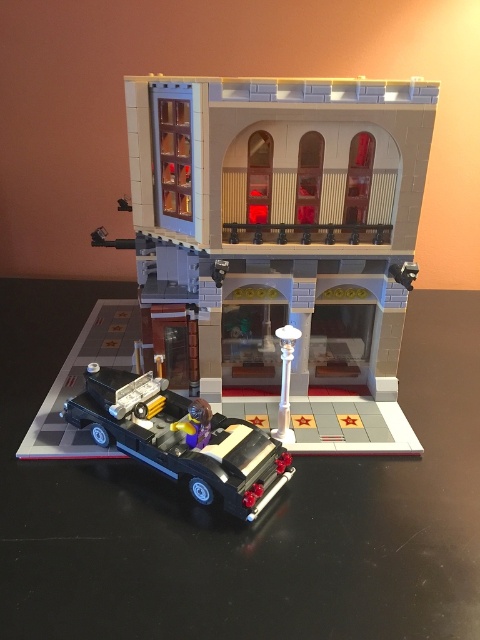
Based on the photo, you are a delivery person trying to reach the matte gray building at center. There is a black plastic car at lower left blocking your path. Can you go around the car to reach the building?

The black plastic car at lower left is behind matte gray building at center, so it is not blocking the path. You can reach the matte gray building at center without any obstruction.

From the picture: You are a toy designer who needs to package the matte gray building at center and the black plastic car at lower left together. Given that the building is much taller than the car, how should you arrange them in the box to ensure both fit securely?

Since the matte gray building at center is much taller than the black plastic car at lower left, place the building upright in one corner of the box and position the car horizontally next to it to maximize space efficiency and prevent damage during transport.

You are a delivery drone trying to deliver a package to the matte gray building at center. The building is located at coordinates point 0.341, 0.581. If you are currently at point 0.2, 0.6, in which direction should you fly to reach the building?

The matte gray building at center is located at point (278,218). Since your current position is at (288,128), you should fly northeast to reach the building.